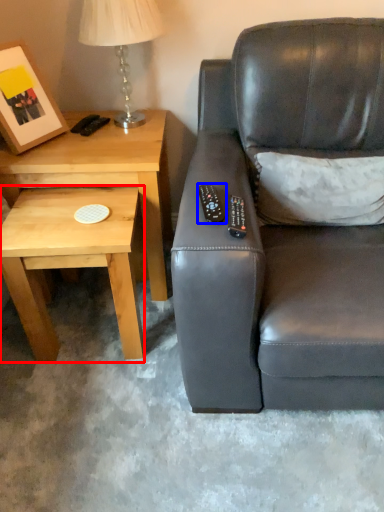
Question: Among these objects, which one is farthest to the camera, coffee table (highlighted by a red box) or remote (highlighted by a blue box)?

Choices:
 (A) coffee table
 (B) remote

Answer: (A)